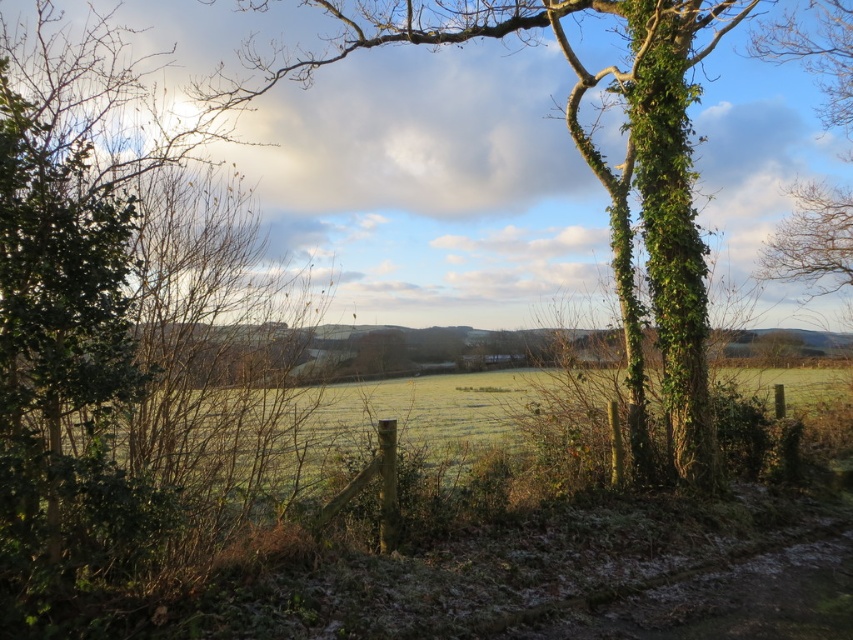
You are standing at the point labeled as point (x=126, y=339) in the image. What type of object are you currently standing on?

The point (x=126, y=339) is on a green leafy tree at left.